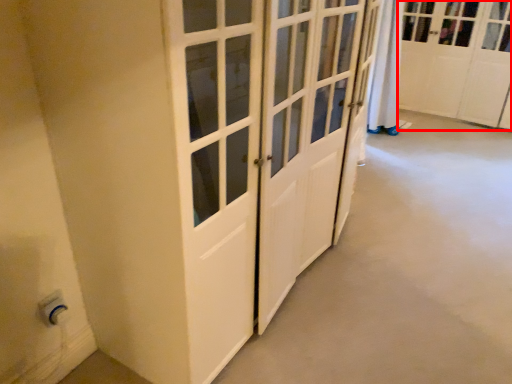
Question: From the image's perspective, where is cabinetry (annotated by the red box) located in relation to electric outlet in the image?

Choices:
 (A) above
 (B) below

Answer: (A)